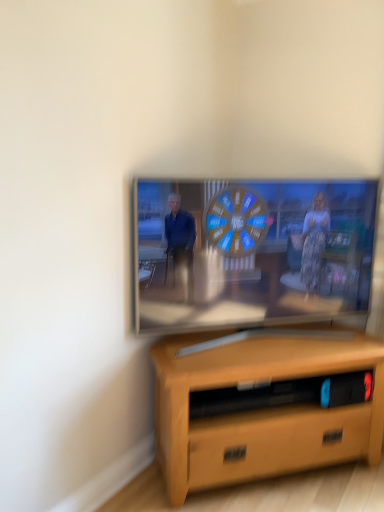
Question: From the image's perspective, is matte wooden tv at center on light brown wood desk at lower center?

Choices:
 (A) yes
 (B) no

Answer: (A)

Question: Does matte wooden tv at center lie behind light brown wood desk at lower center?

Choices:
 (A) no
 (B) yes

Answer: (B)

Question: Is matte wooden tv at center facing away from light brown wood desk at lower center?

Choices:
 (A) no
 (B) yes

Answer: (A)

Question: Is matte wooden tv at center wider than light brown wood desk at lower center?

Choices:
 (A) yes
 (B) no

Answer: (B)

Question: Can you confirm if matte wooden tv at center is positioned to the right of light brown wood desk at lower center?

Choices:
 (A) no
 (B) yes

Answer: (A)

Question: Could you tell me if matte wooden tv at center is turned towards light brown wood desk at lower center?

Choices:
 (A) yes
 (B) no

Answer: (B)

Question: From the image's perspective, is light brown wood desk at lower center on top of matte wooden tv at center?

Choices:
 (A) yes
 (B) no

Answer: (B)

Question: Does light brown wood desk at lower center appear on the right side of matte wooden tv at center?

Choices:
 (A) yes
 (B) no

Answer: (A)

Question: From a real-world perspective, is light brown wood desk at lower center located higher than matte wooden tv at center?

Choices:
 (A) yes
 (B) no

Answer: (B)

Question: Is matte wooden tv at center inside light brown wood desk at lower center?

Choices:
 (A) yes
 (B) no

Answer: (B)

Question: From the image's perspective, is light brown wood desk at lower center below matte wooden tv at center?

Choices:
 (A) no
 (B) yes

Answer: (B)

Question: Does light brown wood desk at lower center have a greater width compared to matte wooden tv at center?

Choices:
 (A) yes
 (B) no

Answer: (A)

Question: Based on their positions, is matte wooden tv at center located to the left or right of light brown wood desk at lower center?

Choices:
 (A) right
 (B) left

Answer: (B)